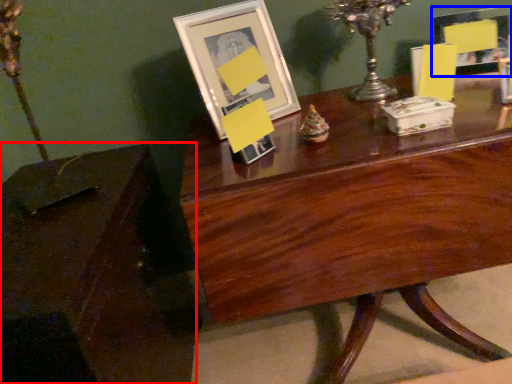
Question: Which object appears farthest to the camera in this image, table (highlighted by a red box) or picture frame (highlighted by a blue box)?

Choices:
 (A) table
 (B) picture frame

Answer: (B)